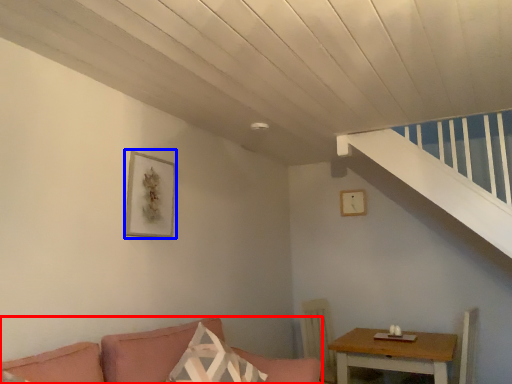
Question: Among these objects, which one is nearest to the camera, studio couch (highlighted by a red box) or picture frame (highlighted by a blue box)?

Choices:
 (A) studio couch
 (B) picture frame

Answer: (A)